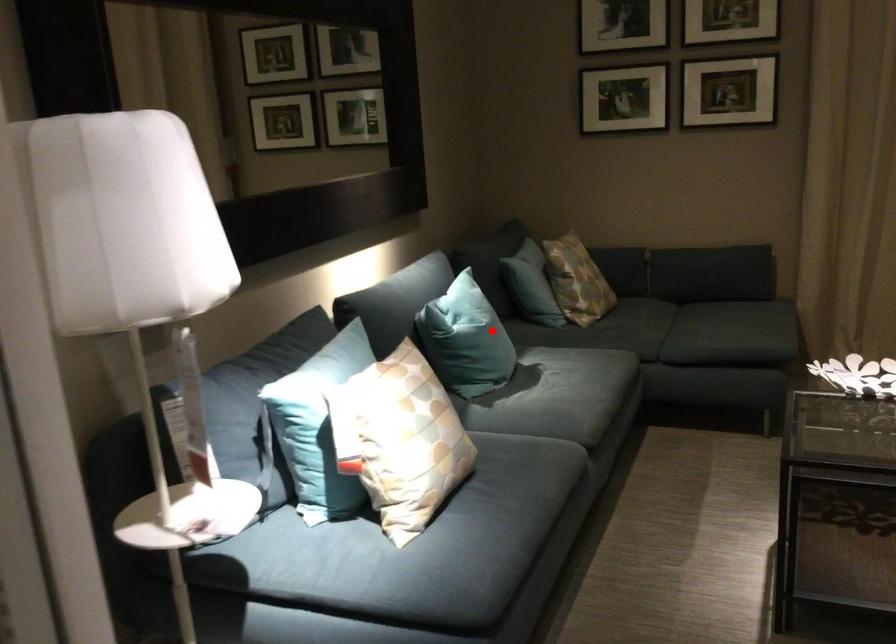
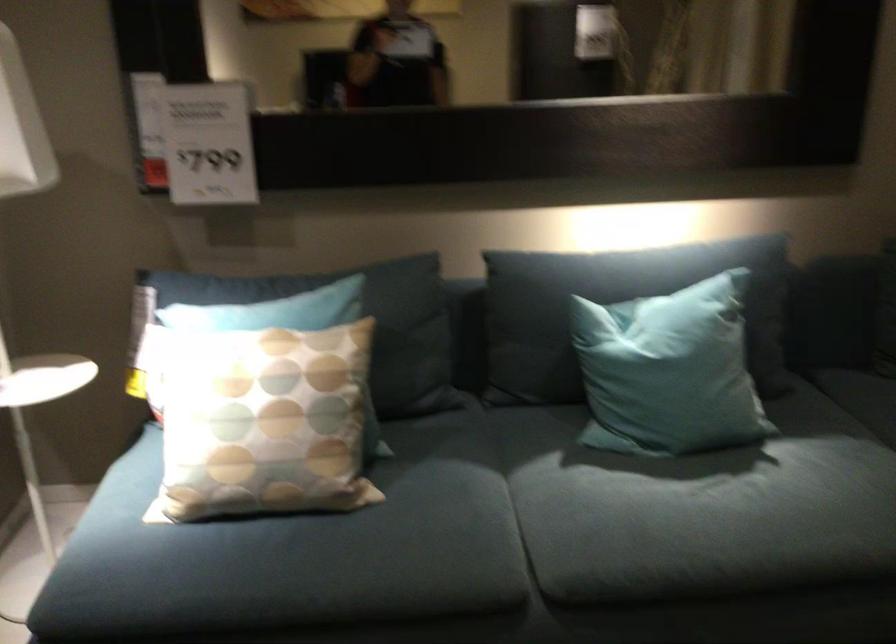
Question: I am providing you with two images of the same scene from different viewpoints. A red point is marked on the first image. Can you still see the location of the red point in image 2?

Choices:
 (A) Yes
 (B) No

Answer: (A)